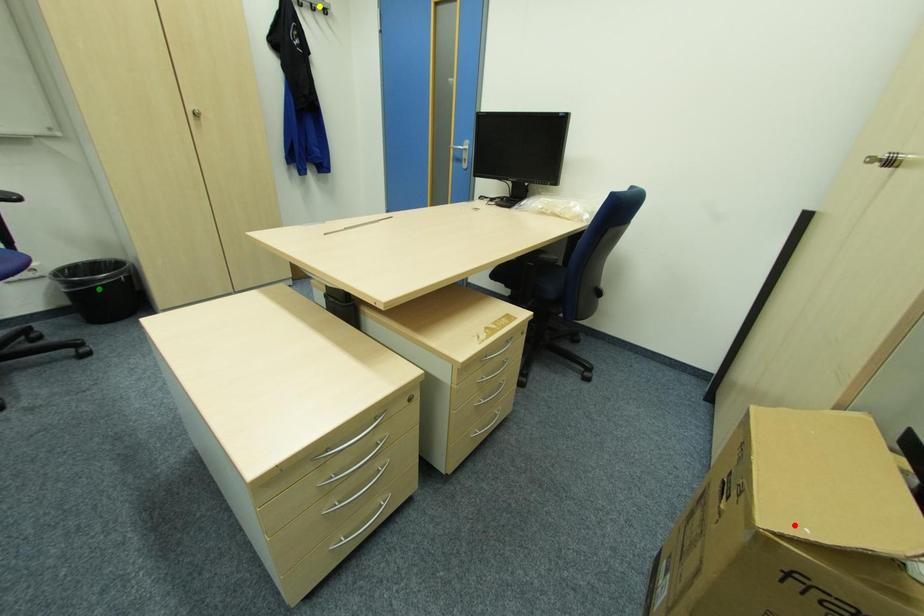
Order these from nearest to farthest:
- green point
- red point
- yellow point

red point, green point, yellow point